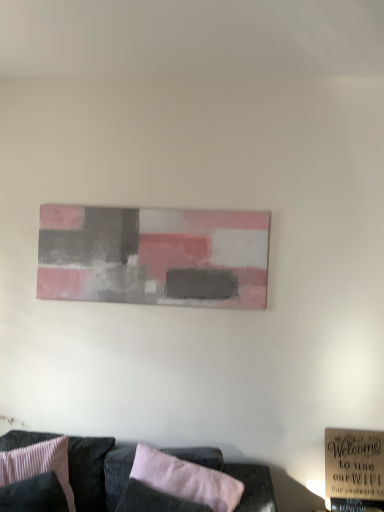
Question: Is pink ribbed fabric pillow at lower left, which is counted as the second pillow, starting from the right, far away from pink fabric pillow at lower center, the second pillow positioned from the left?

Choices:
 (A) no
 (B) yes

Answer: (A)

Question: Can you confirm if pink ribbed fabric pillow at lower left, the 1th pillow when ordered from left to right, is bigger than pink fabric pillow at lower center, the second pillow positioned from the left?

Choices:
 (A) no
 (B) yes

Answer: (B)

Question: Is pink ribbed fabric pillow at lower left, which is counted as the second pillow, starting from the right, looking in the opposite direction of pink fabric pillow at lower center, the second pillow positioned from the left?

Choices:
 (A) yes
 (B) no

Answer: (B)

Question: From a real-world perspective, is pink ribbed fabric pillow at lower left, which is counted as the second pillow, starting from the right, positioned under pink fabric pillow at lower center, the 1th pillow viewed from the right, based on gravity?

Choices:
 (A) yes
 (B) no

Answer: (A)

Question: From a real-world perspective, is pink ribbed fabric pillow at lower left, the 1th pillow when ordered from left to right, on pink fabric pillow at lower center, the second pillow positioned from the left?

Choices:
 (A) no
 (B) yes

Answer: (A)

Question: From a real-world perspective, is velvet black couch at lower center positioned above or below matte acrylic painting at center?

Choices:
 (A) above
 (B) below

Answer: (B)

Question: From the image's perspective, is velvet black couch at lower center above or below matte acrylic painting at center?

Choices:
 (A) above
 (B) below

Answer: (B)

Question: Is velvet black couch at lower center inside or outside of matte acrylic painting at center?

Choices:
 (A) outside
 (B) inside

Answer: (A)

Question: Relative to matte acrylic painting at center, is velvet black couch at lower center in front or behind?

Choices:
 (A) behind
 (B) front

Answer: (B)

Question: Is matte acrylic painting at center inside the boundaries of pink ribbed fabric pillow at lower left, the 1th pillow when ordered from left to right, or outside?

Choices:
 (A) outside
 (B) inside

Answer: (A)

Question: From the image's perspective, is matte acrylic painting at center located above or below pink ribbed fabric pillow at lower left, which is counted as the second pillow, starting from the right?

Choices:
 (A) below
 (B) above

Answer: (B)

Question: Looking at the image, does matte acrylic painting at center seem bigger or smaller compared to pink ribbed fabric pillow at lower left, the 1th pillow when ordered from left to right?

Choices:
 (A) small
 (B) big

Answer: (A)

Question: Is point (160, 236) positioned closer to the camera than point (41, 462)?

Choices:
 (A) closer
 (B) farther

Answer: (B)

Question: Choose the correct answer: Is pink fabric pillow at lower center, the 1th pillow viewed from the right, inside velvet black couch at lower center or outside it?

Choices:
 (A) outside
 (B) inside

Answer: (B)

Question: Considering the positions of pink fabric pillow at lower center, the 1th pillow viewed from the right, and velvet black couch at lower center in the image, is pink fabric pillow at lower center, the 1th pillow viewed from the right, wider or thinner than velvet black couch at lower center?

Choices:
 (A) wide
 (B) thin

Answer: (B)